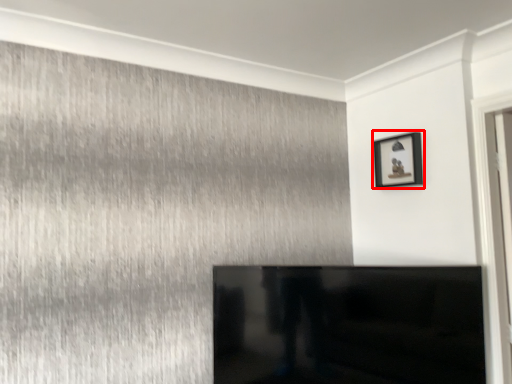
Question: From the image's perspective, where is picture frame (annotated by the red box) located relative to furniture?

Choices:
 (A) above
 (B) below

Answer: (A)